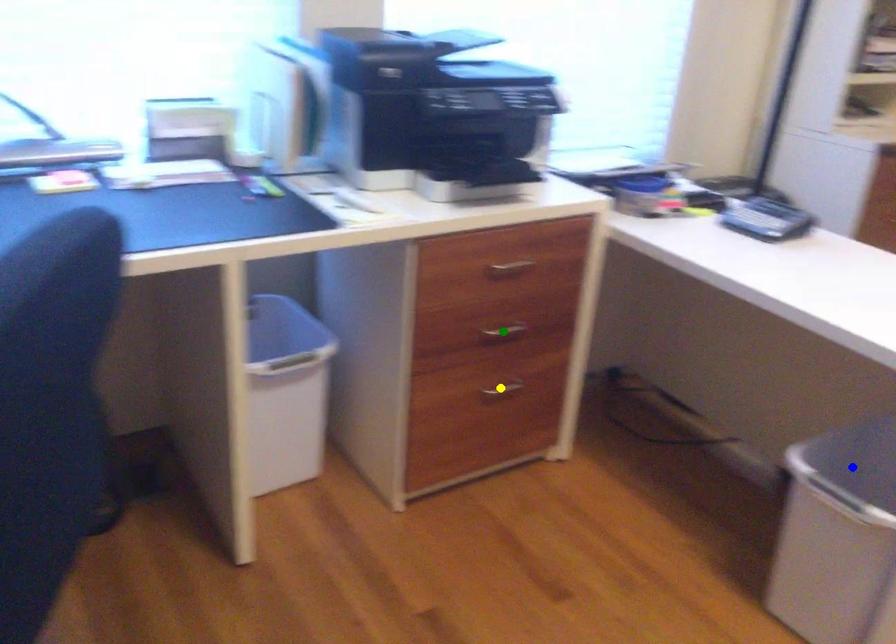
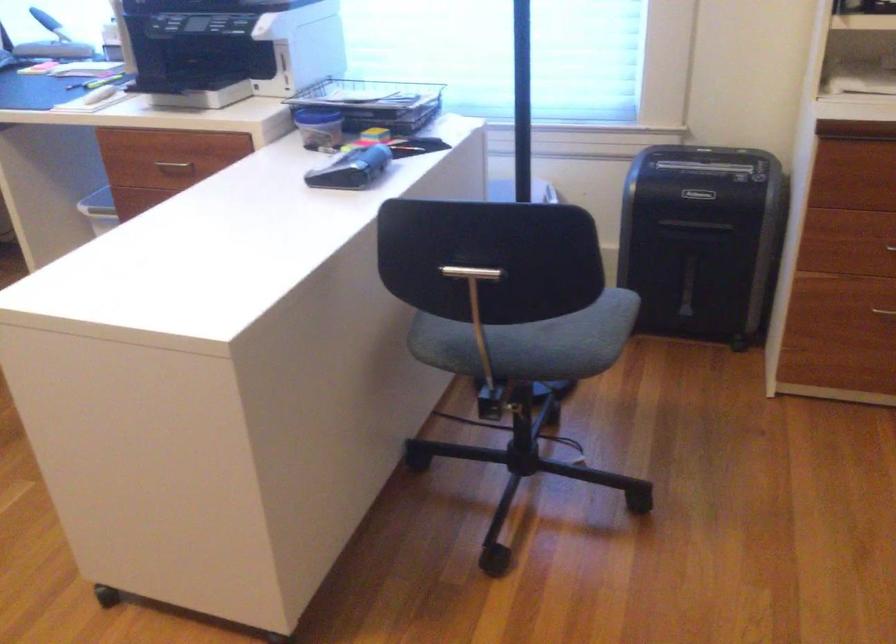
I am providing you with two images of the same scene from different viewpoints. Three points are marked in image1. Which point corresponds to a part or object that is occluded in image2?In image1, three points are marked. Which of them correspond to a part or object that is occluded in image2?Among the three points shown in image1, which one corresponds to a part or object that is no longer visible due to occlusion in image2?

blue point, yellow point, green point cannot be seen in image2.